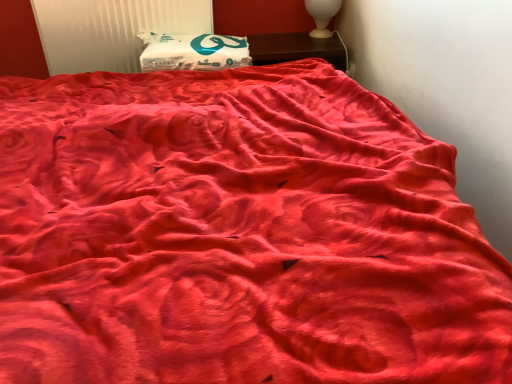
Question: Is wooden nightstand at upper center next to white plastic radiator at upper left?

Choices:
 (A) yes
 (B) no

Answer: (B)

Question: Is there a large distance between wooden nightstand at upper center and white plastic radiator at upper left?

Choices:
 (A) yes
 (B) no

Answer: (B)

Question: Is wooden nightstand at upper center taller than white plastic radiator at upper left?

Choices:
 (A) no
 (B) yes

Answer: (A)

Question: Is wooden nightstand at upper center thinner than white plastic radiator at upper left?

Choices:
 (A) yes
 (B) no

Answer: (B)

Question: Considering the relative sizes of wooden nightstand at upper center and white plastic radiator at upper left in the image provided, is wooden nightstand at upper center smaller than white plastic radiator at upper left?

Choices:
 (A) yes
 (B) no

Answer: (A)

Question: From a real-world perspective, is white matte pillow at upper center above or below white plastic radiator at upper left?

Choices:
 (A) above
 (B) below

Answer: (B)

Question: In terms of height, does white matte pillow at upper center look taller or shorter compared to white plastic radiator at upper left?

Choices:
 (A) tall
 (B) short

Answer: (B)

Question: Is point (150, 36) positioned closer to the camera than point (84, 34)?

Choices:
 (A) closer
 (B) farther

Answer: (B)

Question: In the image, is white matte pillow at upper center positioned in front of or behind white plastic radiator at upper left?

Choices:
 (A) front
 (B) behind

Answer: (A)

Question: Considering the positions of white glossy table lamp at upper right and white matte pillow at upper center in the image, is white glossy table lamp at upper right wider or thinner than white matte pillow at upper center?

Choices:
 (A) thin
 (B) wide

Answer: (A)

Question: Is white glossy table lamp at upper right inside the boundaries of white matte pillow at upper center, or outside?

Choices:
 (A) inside
 (B) outside

Answer: (B)

Question: In terms of size, does white glossy table lamp at upper right appear bigger or smaller than white matte pillow at upper center?

Choices:
 (A) big
 (B) small

Answer: (B)

Question: From the image's perspective, relative to white matte pillow at upper center, is white glossy table lamp at upper right above or below?

Choices:
 (A) above
 (B) below

Answer: (A)

Question: In the image, is white plastic radiator at upper left positioned in front of or behind white matte pillow at upper center?

Choices:
 (A) front
 (B) behind

Answer: (B)

Question: Considering the relative positions of white plastic radiator at upper left and white matte pillow at upper center in the image provided, is white plastic radiator at upper left to the left or to the right of white matte pillow at upper center?

Choices:
 (A) right
 (B) left

Answer: (B)